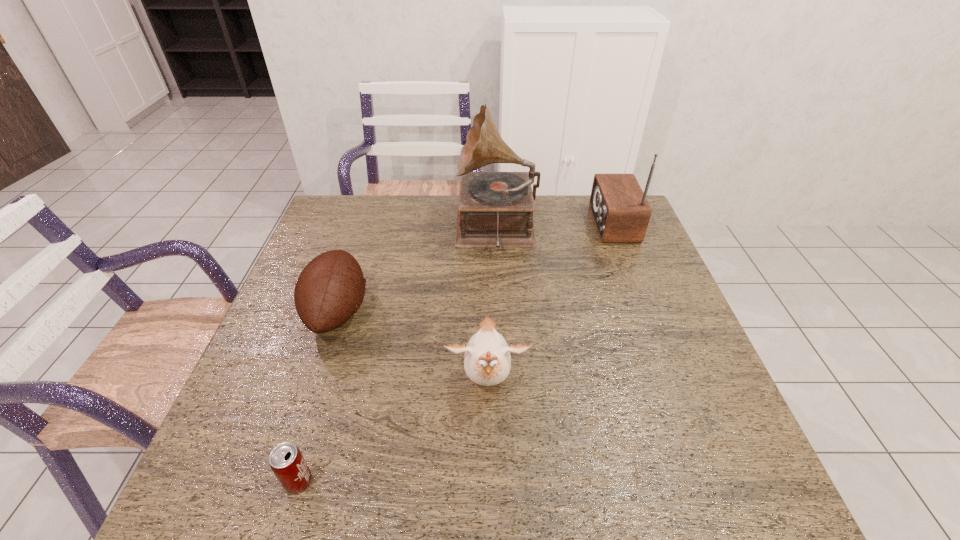
Where is `free space located on the front-facing side of the rightmost object`? free space located on the front-facing side of the rightmost object is located at coordinates (536, 224).

Image resolution: width=960 pixels, height=540 pixels. Identify the location of free space located 0.060m on the front-facing side of the rightmost object. (573, 224).

Find the location of a particular element. The image size is (960, 540). vacant area located on the front-facing side of the rightmost object is located at coordinates (492, 224).

Locate an element on the screen. Image resolution: width=960 pixels, height=540 pixels. free region located 0.070m at the beak of the fourth farthest object is located at coordinates (488, 444).

Locate an element on the screen. The image size is (960, 540). free space located on the laces of the third farthest object is located at coordinates (524, 312).

Image resolution: width=960 pixels, height=540 pixels. I want to click on free space located on the left of the nearest object, so click(x=258, y=481).

Locate an element on the screen. record player that is positioned at the far edge is located at coordinates (495, 209).

In order to click on radio receiver positioned at the far edge in this screenshot , I will do `click(621, 212)`.

Find the location of `object that is positioned at the near edge`. object that is positioned at the near edge is located at coordinates (286, 461).

This screenshot has width=960, height=540. Identify the location of football that is at the left edge. (330, 289).